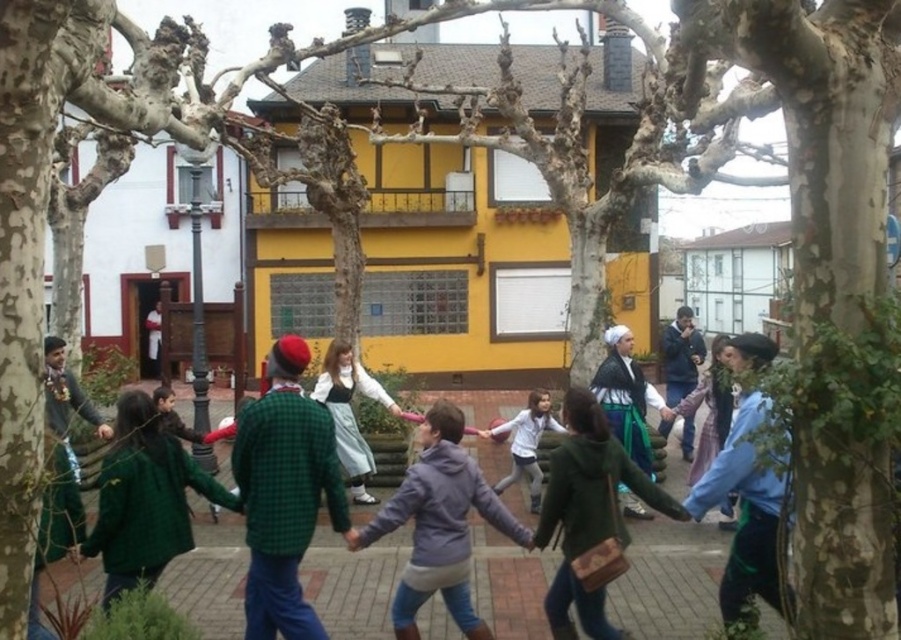
You are standing in the town square and see both the green wool sweater at center and the matte green dress at center. Which one is positioned more to the left side?

The green wool sweater at center is positioned more to the left side than the matte green dress at center.

You are a photographer positioned in the town square and want to capture both the matte green dress at center and the white matte jacket at center in a single frame. Which object should you adjust your camera angle to focus on first to ensure both are in the shot?

The matte green dress at center is to the left of the white matte jacket at center. To capture both in a single frame, focus on the matte green dress at center first as it is positioned to the left, allowing the white matte jacket at center to naturally fall into the right side of the frame.